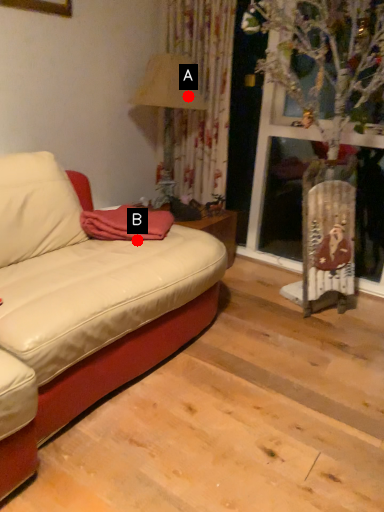
Question: Two points are circled on the image, labeled by A and B beside each circle. Which of the following is the closest to the observer?

Choices:
 (A) A is closer
 (B) B is closer

Answer: (B)